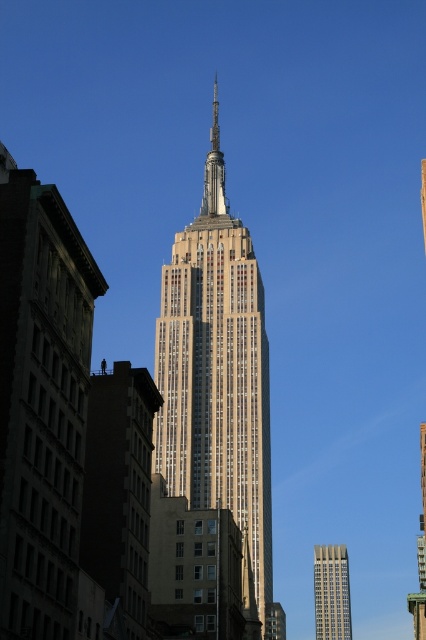
Does point (227, 266) lie behind point (333, 621)?

No.

Which is more to the left, beige stone tower at center or gray glass skyscraper at lower right?

beige stone tower at center

This screenshot has height=640, width=426. I want to click on beige stone tower at center, so click(x=216, y=372).